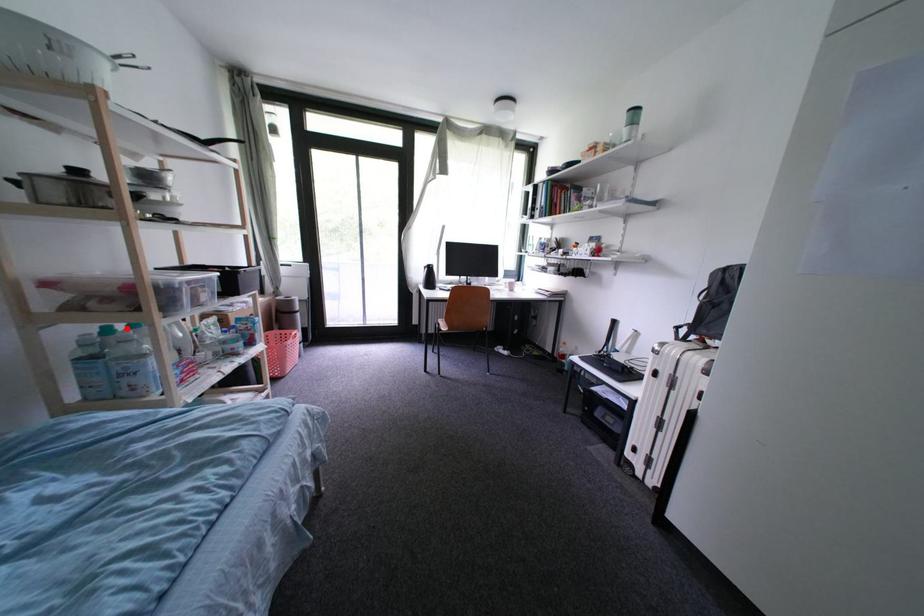
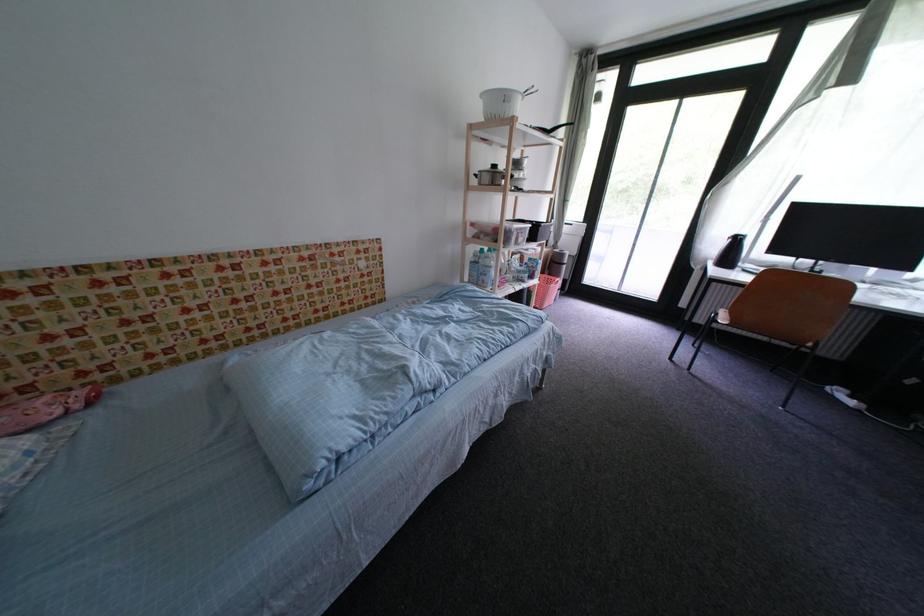
Locate, in the second image, the point that corresponds to the highlighted location in the first image.

(493, 252)